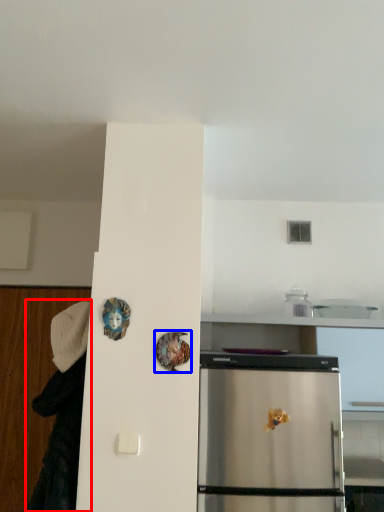
Question: Which point is further to the camera, couple (highlighted by a red box) or art (highlighted by a blue box)?

Choices:
 (A) couple
 (B) art

Answer: (A)